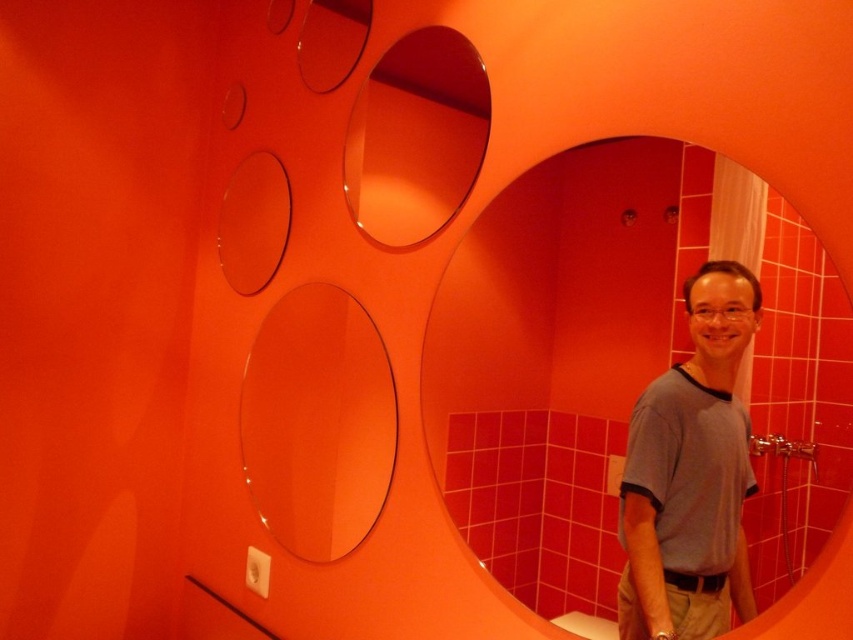
Is transparent glass mirror at center taller than transparent glass oval at center?

Yes.

Between point (804, 253) and point (309, 355), which one is positioned in front?

Point (804, 253) is in front.

Between point (567, 534) and point (248, 483), which one is positioned behind?

The point (248, 483) is more distant.

Find the location of a particular element. The width and height of the screenshot is (853, 640). transparent glass mirror at center is located at coordinates (558, 356).

Is transparent glass mirror at center wider than transparent glass mirror at upper center?

Correct, the width of transparent glass mirror at center exceeds that of transparent glass mirror at upper center.

Is transparent glass mirror at center above transparent glass mirror at upper center?

Actually, transparent glass mirror at center is below transparent glass mirror at upper center.

At what (x,y) coordinates should I click in order to perform the action: click on transparent glass mirror at center. Please return your answer as a coordinate pair (x, y). The width and height of the screenshot is (853, 640). Looking at the image, I should click on (558, 356).

Which is behind, point (660, 504) or point (383, 148)?

The point (383, 148) is behind.

What do you see at coordinates (689, 474) in the screenshot?
I see `gray cotton shirt at center` at bounding box center [689, 474].

Identify the location of gray cotton shirt at center. Image resolution: width=853 pixels, height=640 pixels. (689, 474).